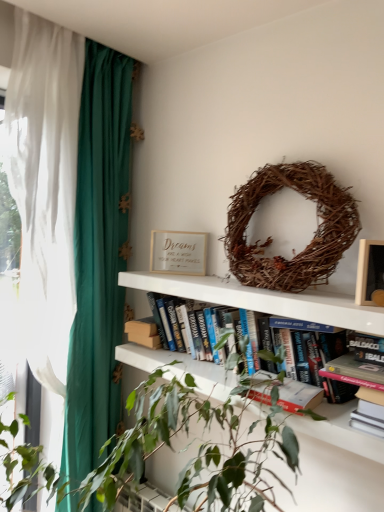
Question: Should I look upward or downward to see brown woven wreath at upper center?

Choices:
 (A) down
 (B) up

Answer: (B)

Question: From the image's perspective, would you say brown woven wreath at upper center is positioned over wooden picture frame at upper right?

Choices:
 (A) yes
 (B) no

Answer: (A)

Question: Is brown woven wreath at upper center closer to camera compared to wooden picture frame at upper right?

Choices:
 (A) yes
 (B) no

Answer: (B)

Question: Considering the relative sizes of brown woven wreath at upper center and wooden picture frame at upper right in the image provided, is brown woven wreath at upper center shorter than wooden picture frame at upper right?

Choices:
 (A) no
 (B) yes

Answer: (A)

Question: Considering the relative sizes of brown woven wreath at upper center and wooden picture frame at upper right in the image provided, is brown woven wreath at upper center smaller than wooden picture frame at upper right?

Choices:
 (A) yes
 (B) no

Answer: (B)

Question: Does brown woven wreath at upper center have a lesser width compared to wooden picture frame at upper right?

Choices:
 (A) no
 (B) yes

Answer: (A)

Question: From a real-world perspective, is brown woven wreath at upper center under wooden picture frame at upper right?

Choices:
 (A) no
 (B) yes

Answer: (A)

Question: Does matte gold frame at upper center have a smaller size compared to green leafy plant at center?

Choices:
 (A) no
 (B) yes

Answer: (B)

Question: From a real-world perspective, is matte gold frame at upper center positioned under green leafy plant at center based on gravity?

Choices:
 (A) yes
 (B) no

Answer: (B)

Question: From the image's perspective, is matte gold frame at upper center located above green leafy plant at center?

Choices:
 (A) yes
 (B) no

Answer: (A)

Question: Is green leafy plant at center inside matte gold frame at upper center?

Choices:
 (A) no
 (B) yes

Answer: (A)

Question: From a real-world perspective, is matte gold frame at upper center positioned over green leafy plant at center based on gravity?

Choices:
 (A) no
 (B) yes

Answer: (B)

Question: Is matte gold frame at upper center wider than green leafy plant at center?

Choices:
 (A) yes
 (B) no

Answer: (B)

Question: Is matte gold frame at upper center surrounding wooden picture frame at upper right?

Choices:
 (A) yes
 (B) no

Answer: (B)